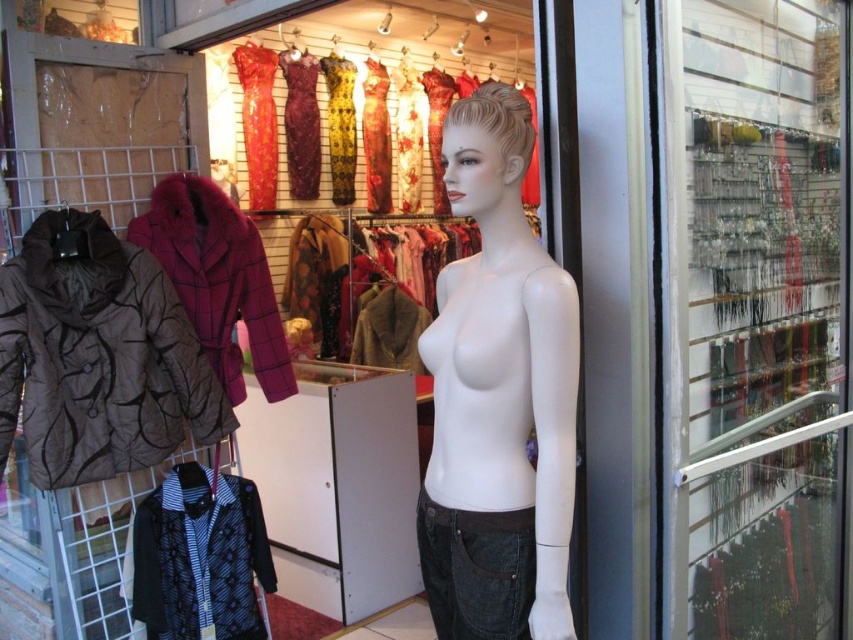
Who is taller, yellow patterned fabric dress at center or shiny floral dress at center?

shiny floral dress at center

Based on the photo, can you confirm if yellow patterned fabric dress at center is taller than shiny floral dress at center?

In fact, yellow patterned fabric dress at center may be shorter than shiny floral dress at center.

Is point (340, 156) in front of point (381, 182)?

Yes, point (340, 156) is in front of point (381, 182).

Locate an element on the screen. yellow patterned fabric dress at center is located at coordinates (340, 125).

Which is above, white matte mannequin at center or brown quilted jacket at left?

white matte mannequin at center is higher up.

Who is more distant from viewer, (519, 305) or (167, 452)?

The point (167, 452) is more distant.

The width and height of the screenshot is (853, 640). I want to click on white matte mannequin at center, so click(x=498, y=397).

Where is `patterned fabric jacket at lower left`? This screenshot has height=640, width=853. patterned fabric jacket at lower left is located at coordinates (200, 556).

Does patterned fabric jacket at lower left have a smaller size compared to dark denim jeans at center?

No.

In order to click on patterned fabric jacket at lower left in this screenshot , I will do `click(200, 556)`.

Where is `patterned fabric jacket at lower left`? patterned fabric jacket at lower left is located at coordinates (200, 556).